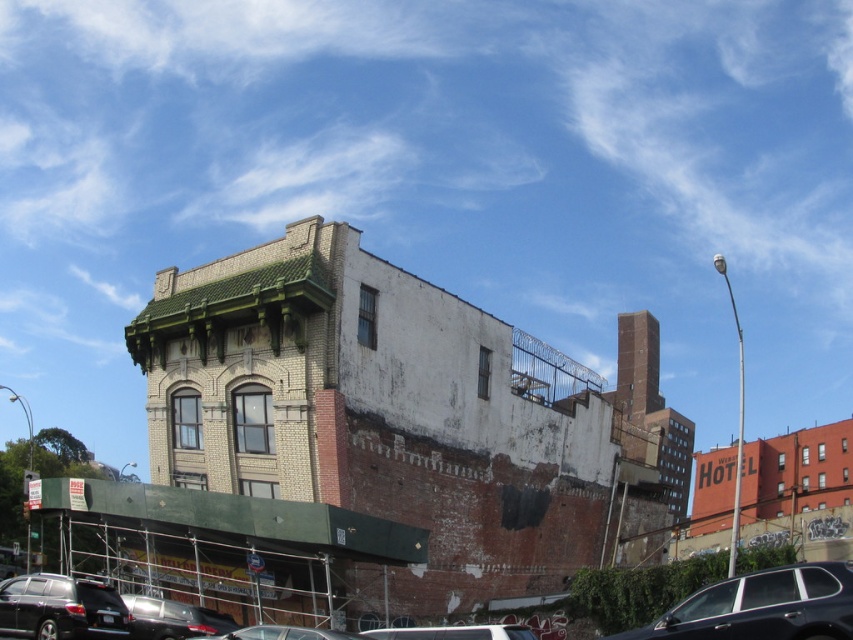
You are a delivery driver who needs to park your vehicle in this area. Your vehicle is 1.8 meters wide. You see a shiny black suv at lower left and a white matte car at lower center parked here. Can you determine if your vehicle will fit between them?

The shiny black suv at lower left is narrower than the white matte car at lower center. Since your vehicle is 1.8 meters wide, you need to check the space between them. However, without knowing the exact distance between the two cars, it is impossible to determine if your vehicle will fit. Please measure the space before attempting to park.

You are a delivery person driving a vehicle and need to park in a tight space between the shiny black sedan at lower right and the shiny silver car at lower left. The parking space is only 1.6 meters tall. Can both cars fit vertically in this space?

The shiny black sedan at lower right is taller than the shiny silver car at lower left. Since the parking space is only 1.6 meters tall, and the shiny black sedan at lower right is taller, it might not fit. Therefore, both cars cannot fit vertically in this space.

You are a delivery person trying to park your vehicle in a narrow alley next to the multi story building. You have a choice between the shiny black suv at lower left and the white matte car at lower center. Which vehicle would be better for tight spaces based on their heights?

The shiny black suv at lower left has a lesser height compared to the white matte car at lower center, so the shiny black suv at lower left would be better for tight spaces as it is shorter.